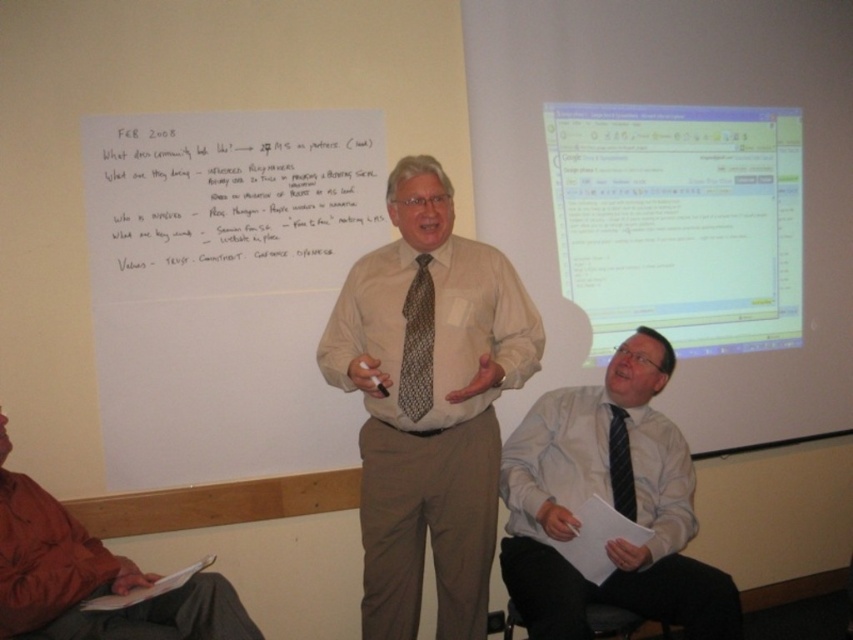
You are standing in the room and want to place a small plant on the floor at point [169,422]. The plant requires a minimum of 6 feet of space from any obstacles. Is the location suitable?

The distance of point [169,422] from camera is 8.38 feet, so the location is suitable as it meets the minimum 6 feet requirement.

You are an attendee at this meeting. You need to hand a document to the presenter. Which person should you approach, the light brown shirt at center or the white shirt at center?

The light brown shirt at center is the presenter and is in front of the white shirt at center, so you should approach the light brown shirt at center.

You are a photographer in a meeting room. You need to take a photo of the light brown shirt at center and the brown textured tie at center. The camera has a maximum focus range of 5 inches. Can you capture both in focus without moving the camera?

The light brown shirt at center is 6.62 inches away from the brown textured tie at center. Since the distance between them exceeds the camera maximum focus range of 5 inches, you cannot capture both in focus without moving the camera.